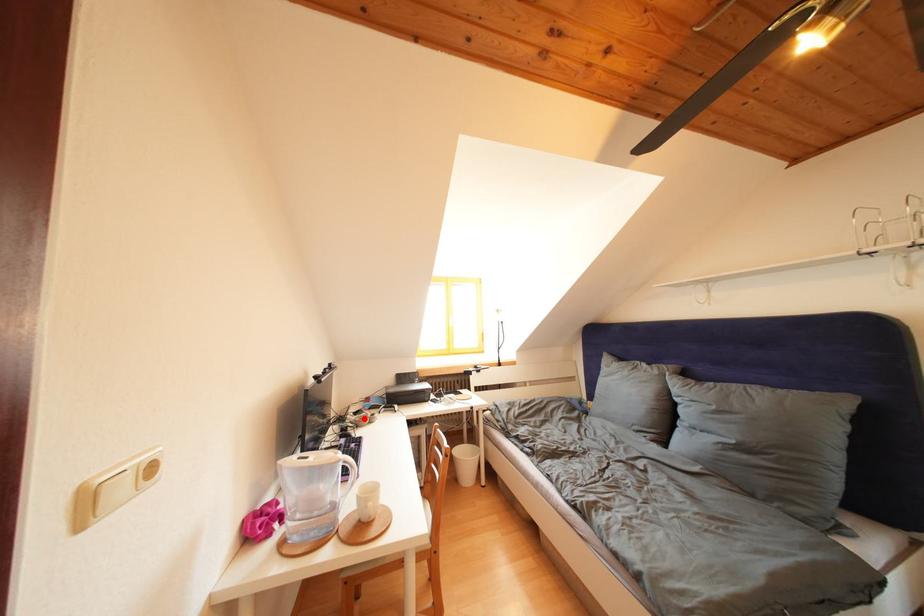
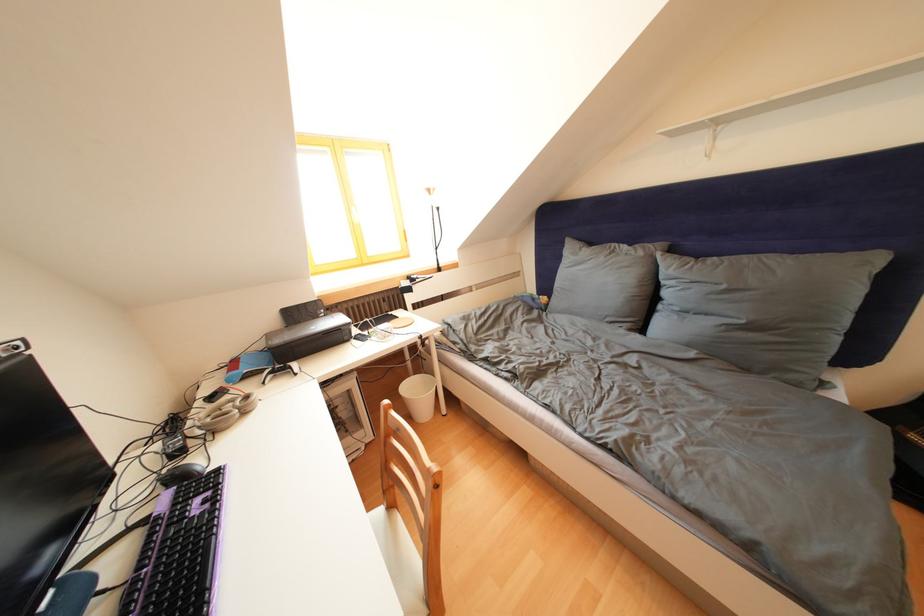
The point at the highlighted location is marked in the first image. Where is the corresponding point in the second image?

(220, 403)